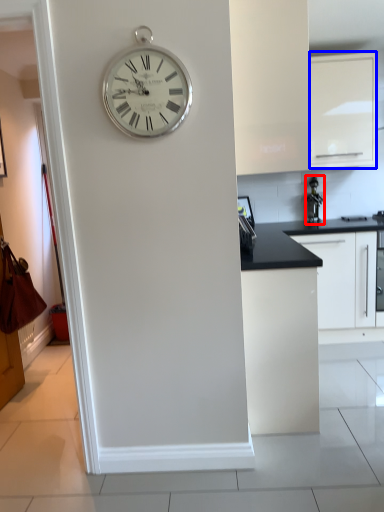
Question: Among these objects, which one is nearest to the camera, appliance (highlighted by a red box) or cabinetry (highlighted by a blue box)?

Choices:
 (A) appliance
 (B) cabinetry

Answer: (B)